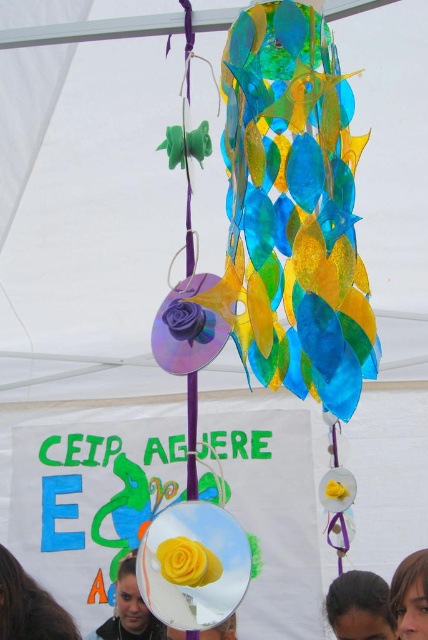
Question: Which object is positioned closest to the smooth brown hair at lower right?

Choices:
 (A) brown hair at lower left
 (B) matte yellow hair at lower center
 (C) dark brown hair at lower right
 (D) smooth skin face at lower center

Answer: (C)

Question: Which object is farther from the camera taking this photo?

Choices:
 (A) brown hair at lower left
 (B) smooth brown hair at lower right

Answer: (A)

Question: Does matte yellow hair at lower center appear on the left side of smooth brown hair at lower right?

Choices:
 (A) yes
 (B) no

Answer: (A)

Question: Is brown hair at lower left closer to camera compared to smooth skin face at lower center?

Choices:
 (A) no
 (B) yes

Answer: (A)

Question: Where is dark brown hair at lower right located in relation to matte yellow hair at lower center in the image?

Choices:
 (A) below
 (B) above

Answer: (B)

Question: Considering the real-world distances, which object is closest to the brown hair at lower left?

Choices:
 (A) smooth skin face at lower center
 (B) dark brown hair at lower right
 (C) matte yellow hair at lower center

Answer: (A)